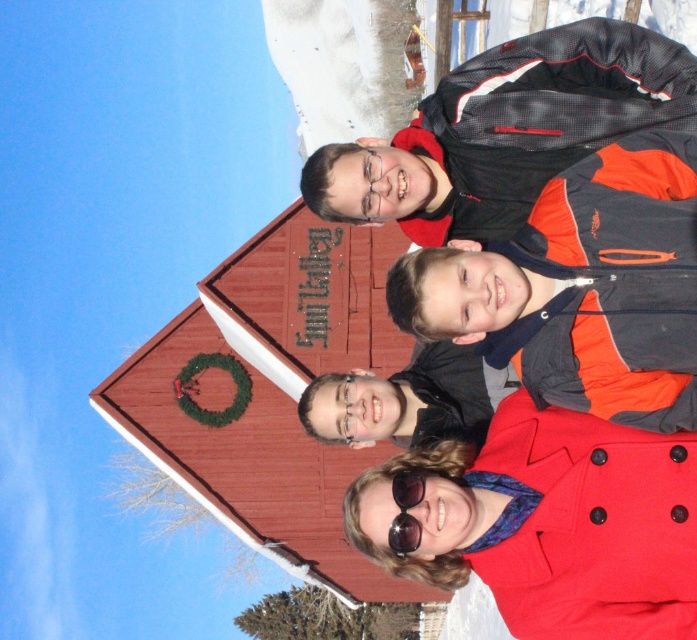
You are a photographer trying to adjust the composition of the photo. You want to ensure that the red matte coat at lower right and the black reflective sunglasses at center are both visible in the frame. Based on their positions, which object is closer to the bottom of the image?

The black reflective sunglasses at center is closer to the bottom of the image because the red matte coat at lower right is located above it.

You are a photographer trying to locate the red matte coat at lower right in the image. According to the coordinates provided, where exactly would you find it?

The red matte coat at lower right can be found at the coordinates point (551, 522).